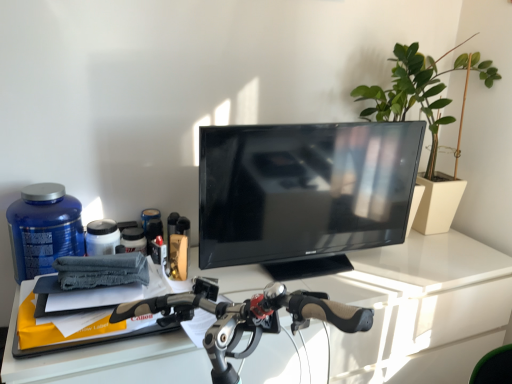
Locate an element on the screen. The image size is (512, 384). vacant area that lies to the right of black glossy tv at center is located at coordinates (397, 263).